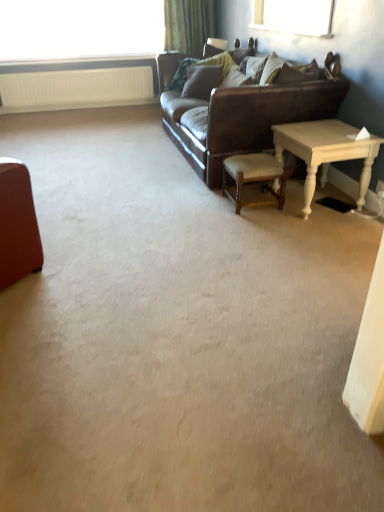
The width and height of the screenshot is (384, 512). I want to click on free space in front of white painted wood table at right, so click(x=325, y=232).